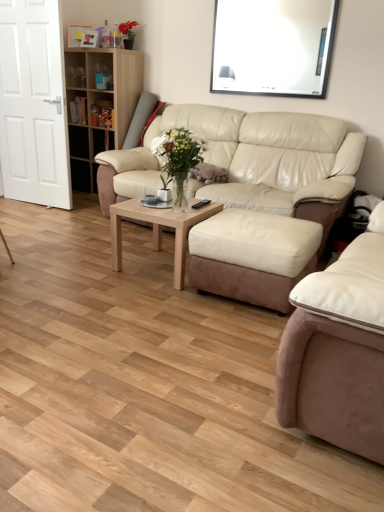
Where is `vacant space in front of white glossy door at left`? The image size is (384, 512). vacant space in front of white glossy door at left is located at coordinates (34, 213).